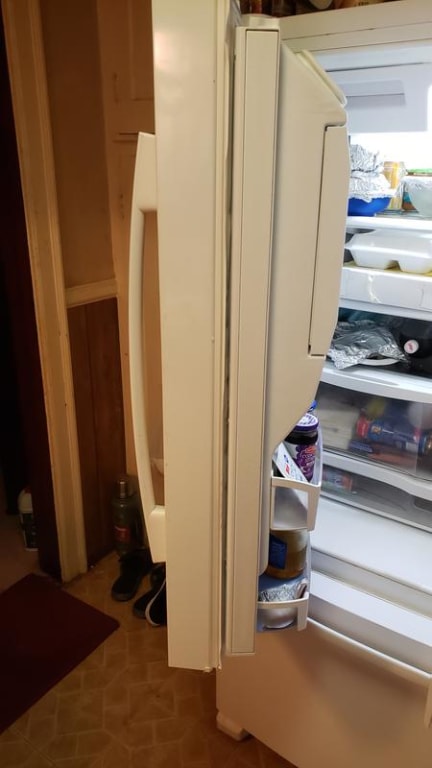
Where is `rug`? rug is located at coordinates (43, 634).